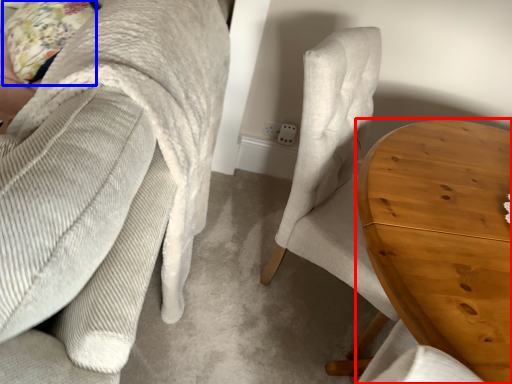
Question: Which object is further to the camera taking this photo, table (highlighted by a red box) or pillow (highlighted by a blue box)?

Choices:
 (A) table
 (B) pillow

Answer: (B)